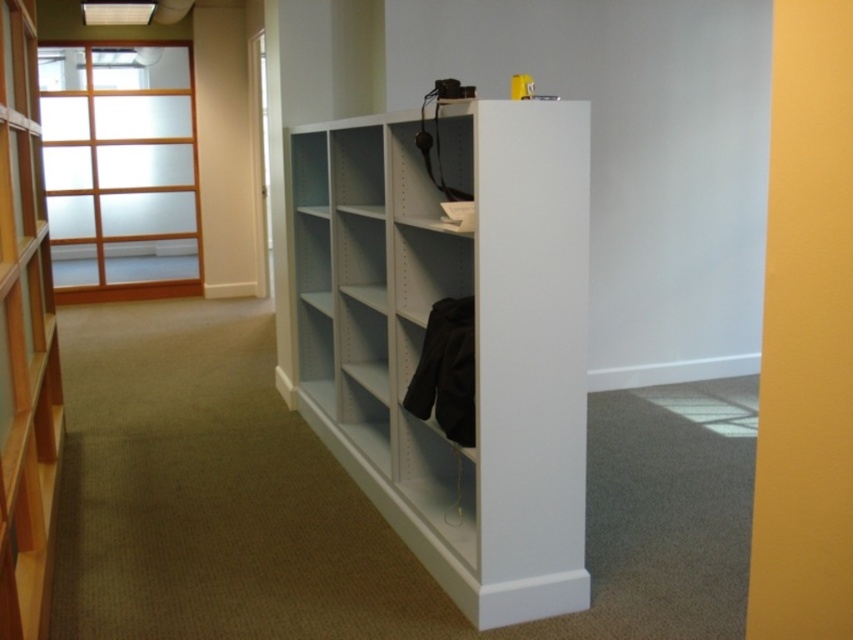
Question: Is white matte bookshelf at center to the left of light brown wood bookshelf at left from the viewer's perspective?

Choices:
 (A) yes
 (B) no

Answer: (B)

Question: Does white matte bookshelf at center have a smaller size compared to light brown wood bookshelf at left?

Choices:
 (A) yes
 (B) no

Answer: (A)

Question: Can you confirm if white matte bookshelf at center is positioned below light brown wood bookshelf at left?

Choices:
 (A) no
 (B) yes

Answer: (B)